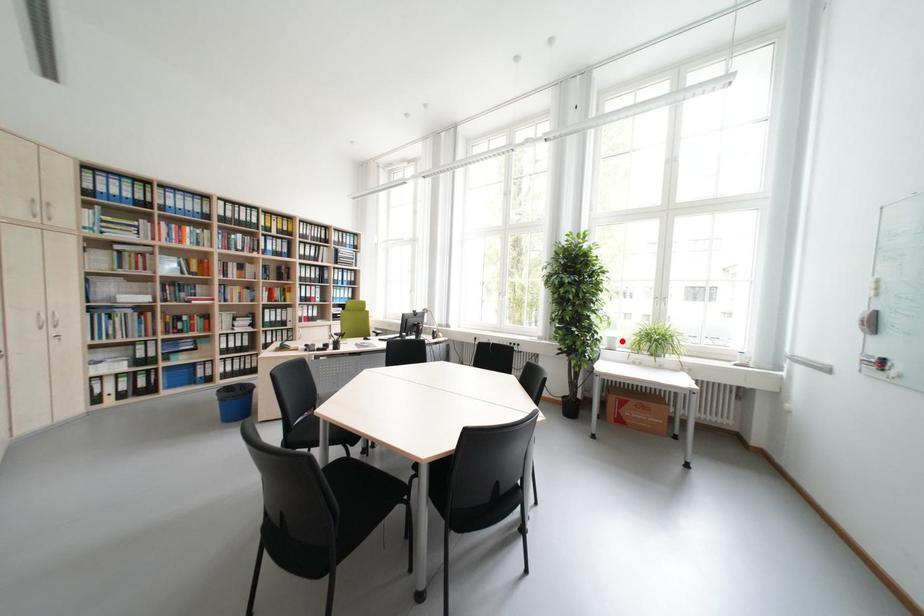
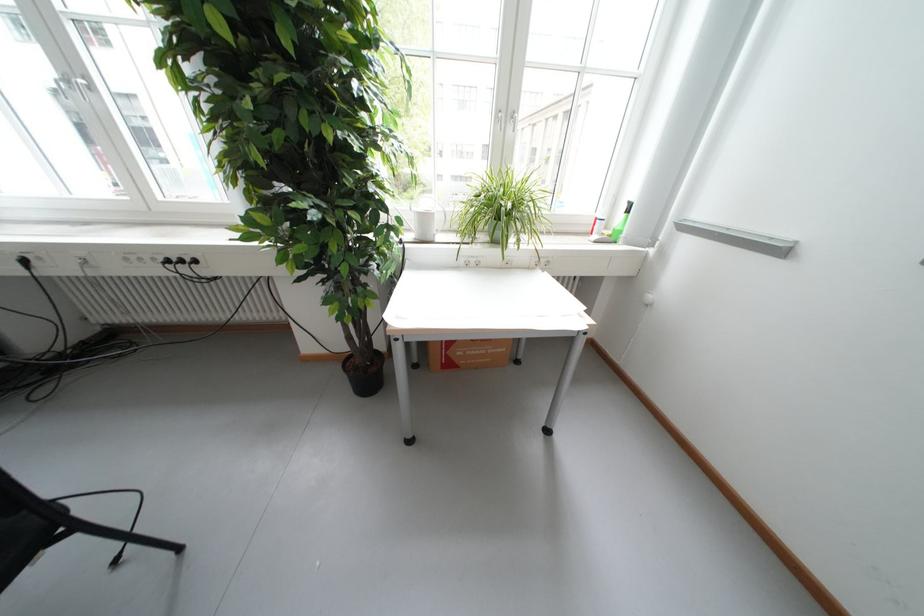
Question: I am providing you with two images of the same scene from different viewpoints. Given a red point in image1, look at the same physical point in image2. Is it:

Choices:
 (A) Closer to the viewpoint
 (B) Farther from the viewpoint

Answer: (A)